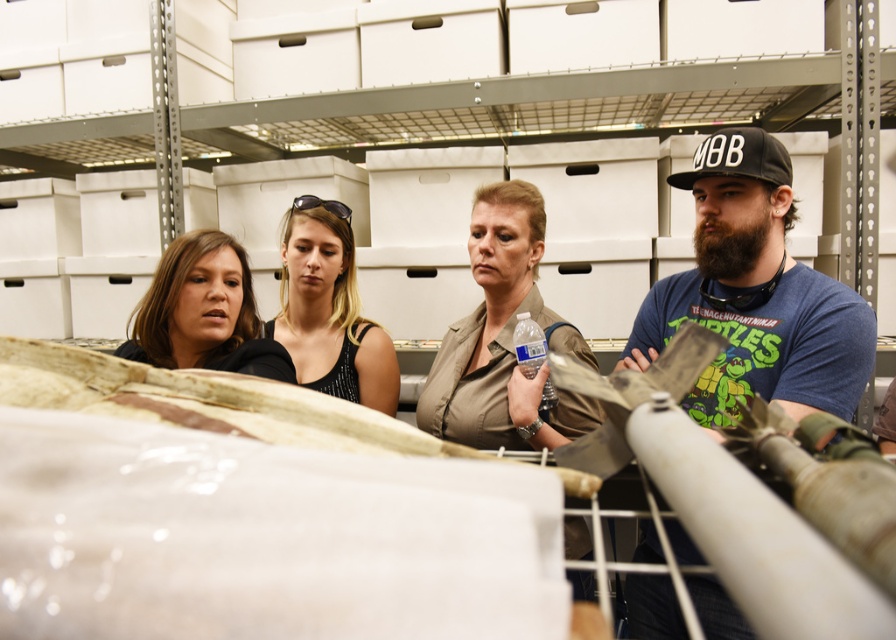
You are standing at the position of the person wearing the black matte tank top at center. You want to hand a document to the person wearing the black top on the far left. How many steps do you need to take to reach them?

The distance between the black matte tank top at center and the black top on the far left is 5.62 feet. Assuming an average step length of about 2.5 feet, you would need to take approximately 2 steps to cover the distance.